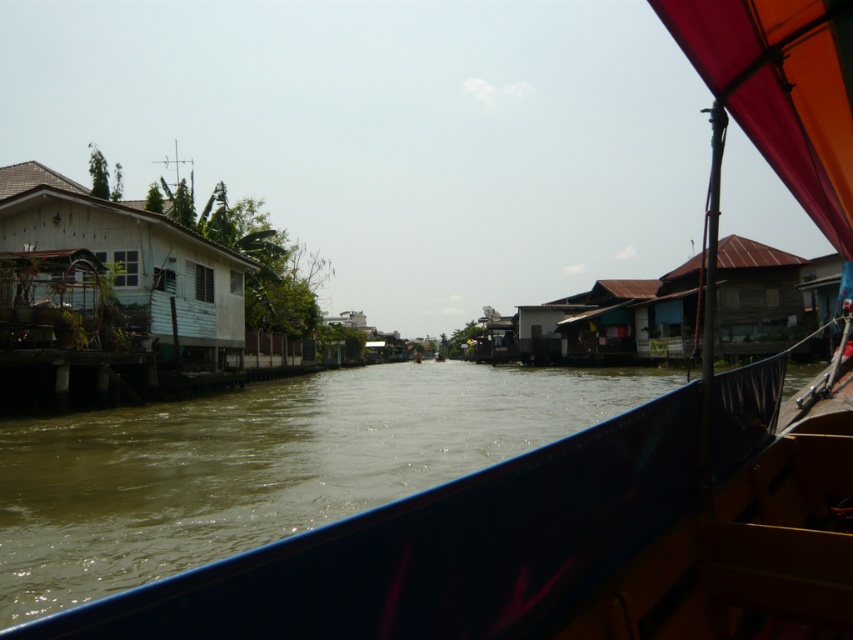
Which of these two, white weathered wood house at left or brown wooden hut at right, stands shorter?

Standing shorter between the two is brown wooden hut at right.

Describe the element at coordinates (135, 260) in the screenshot. I see `white weathered wood house at left` at that location.

Locate an element on the screen. This screenshot has height=640, width=853. white weathered wood house at left is located at coordinates (135, 260).

Does point (639, 484) come farther from viewer compared to point (784, 346)?

No, it is not.

Can you confirm if brown murky water at center is positioned to the left of brown wooden hut at right?

Yes, brown murky water at center is to the left of brown wooden hut at right.

Between point (686, 404) and point (764, 337), which one is positioned in front?

Point (686, 404)

Locate an element on the screen. brown murky water at center is located at coordinates coord(437,548).

Does brown murky water at center have a lesser height compared to white weathered wood house at left?

Correct, brown murky water at center is not as tall as white weathered wood house at left.

Who is more distant from viewer, (x=350, y=618) or (x=194, y=352)?

The point (x=194, y=352) is more distant.

Image resolution: width=853 pixels, height=640 pixels. I want to click on brown murky water at center, so [x=437, y=548].